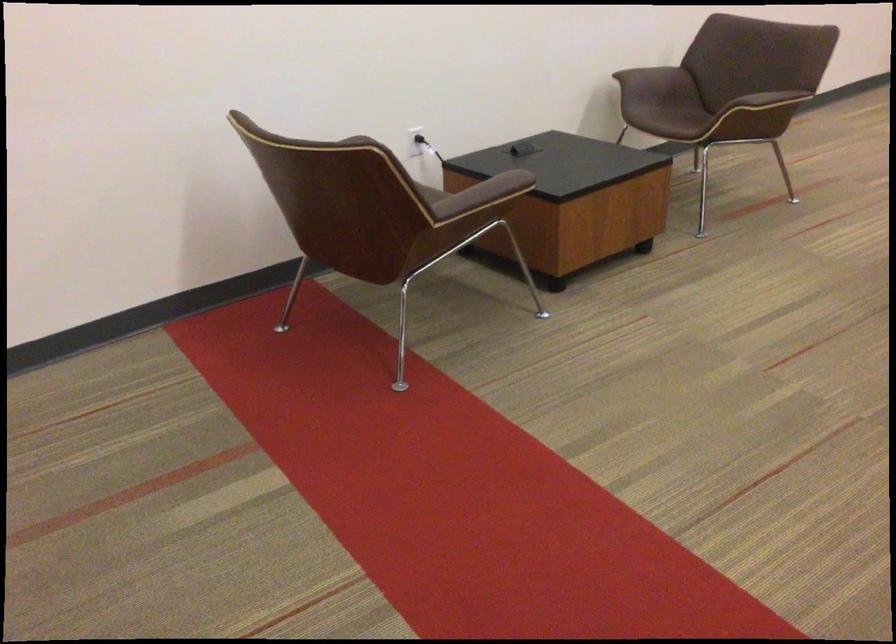
Where would you sit the brown chair sitting surface? Please return your answer as a coordinate pair (x, y).

(673, 118)